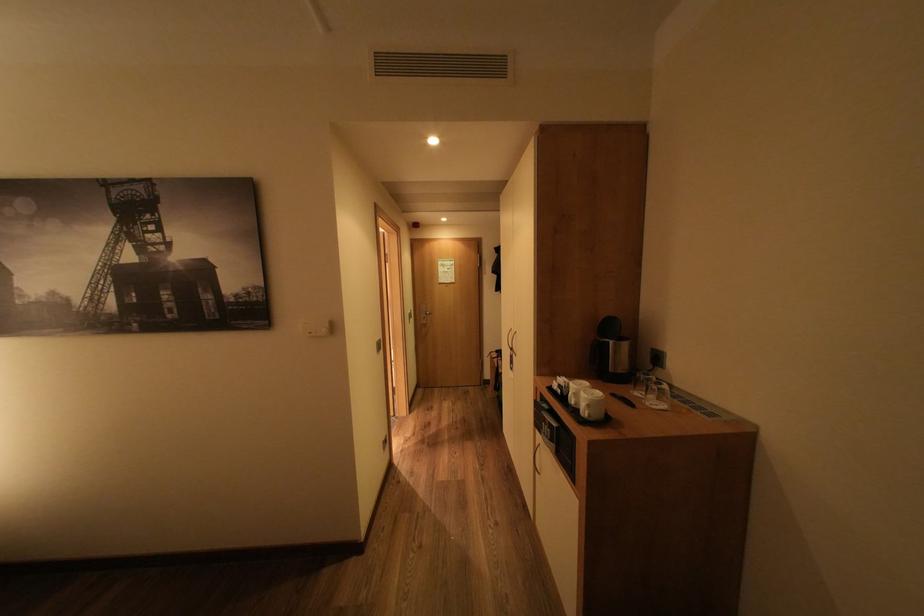
At what (x,y) coordinates should I click in order to perform the action: click on white light switch. Please return your answer as a coordinate pair (x, y). The width and height of the screenshot is (924, 616). Looking at the image, I should click on (317, 326).